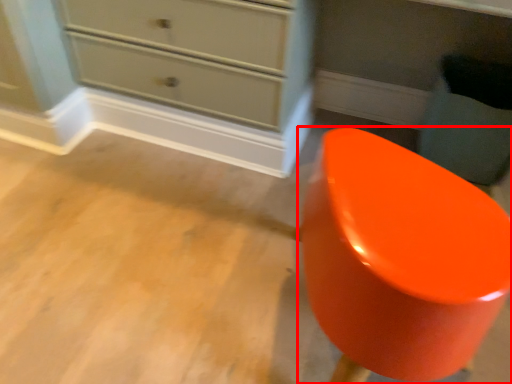
Question: From the image, what is the correct spatial relationship of furniture (annotated by the red box) in relation to swivel chair?

Choices:
 (A) right
 (B) left

Answer: (B)